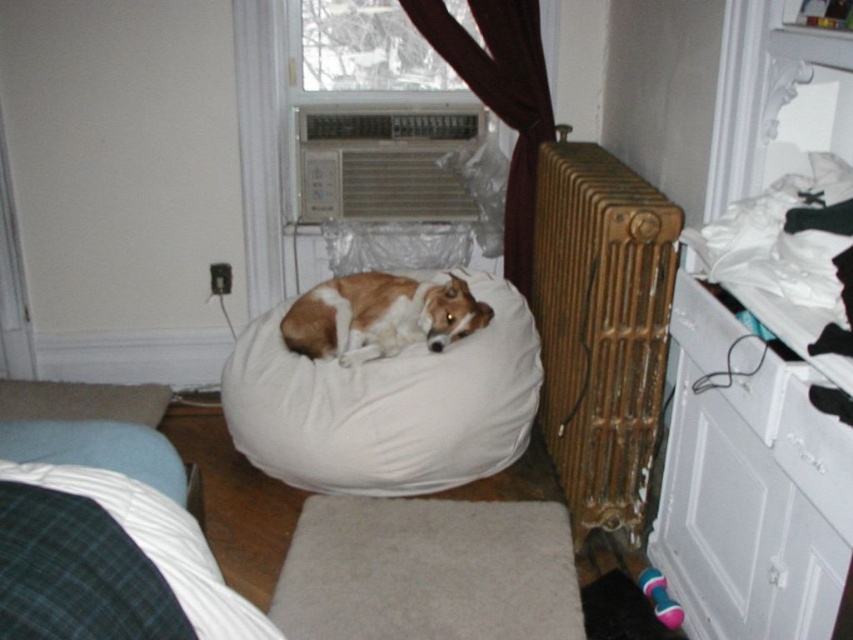
Between white plastic heater at upper center and white glossy drawer at right, which one is positioned lower?

white glossy drawer at right

The width and height of the screenshot is (853, 640). I want to click on white plastic heater at upper center, so click(x=383, y=163).

Does gold textured radiator at right appear on the right side of white fabric dog bed at center?

Indeed, gold textured radiator at right is positioned on the right side of white fabric dog bed at center.

Who is lower down, gold textured radiator at right or white fabric dog bed at center?

white fabric dog bed at center

Does point (647, 296) lie in front of point (424, 352)?

That is True.

The image size is (853, 640). In order to click on gold textured radiator at right in this screenshot , I will do click(x=601, y=330).

Is gold textured radiator at right further to the viewer compared to brown and white fur at center?

No, gold textured radiator at right is in front of brown and white fur at center.

Can you confirm if gold textured radiator at right is positioned above brown and white fur at center?

Actually, gold textured radiator at right is below brown and white fur at center.

Is point (613, 241) farther from camera compared to point (367, 289)?

No, it is not.

The image size is (853, 640). Identify the location of gold textured radiator at right. (601, 330).